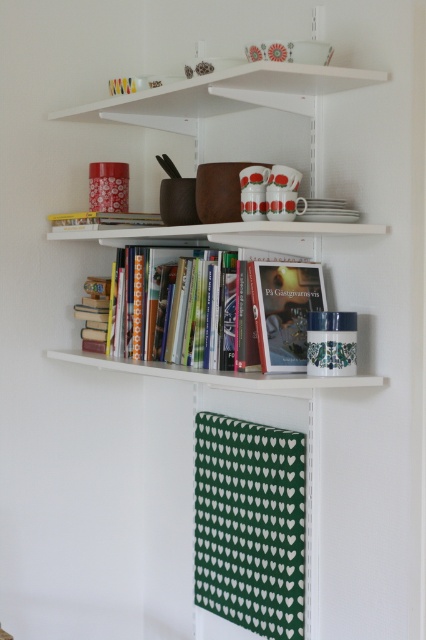
Question: Which object is positioned farthest from the hardcover books at center?

Choices:
 (A) white matte bookshelf at upper center
 (B) green paper book at center

Answer: (B)

Question: Is the position of green paper book at center more distant than that of white matte bookshelf at upper center?

Choices:
 (A) yes
 (B) no

Answer: (A)

Question: Is green paper book at center thinner than white matte bookshelf at upper center?

Choices:
 (A) no
 (B) yes

Answer: (B)

Question: Can you confirm if white matte bookshelf at upper center is positioned above hardcover books at center?

Choices:
 (A) yes
 (B) no

Answer: (A)

Question: Which of the following is the closest to the observer?

Choices:
 (A) white matte bookshelf at upper center
 (B) green paper book at center
 (C) hardcover books at center

Answer: (A)

Question: Which object appears closest to the camera in this image?

Choices:
 (A) green paper book at center
 (B) white matte bookshelf at upper center

Answer: (B)